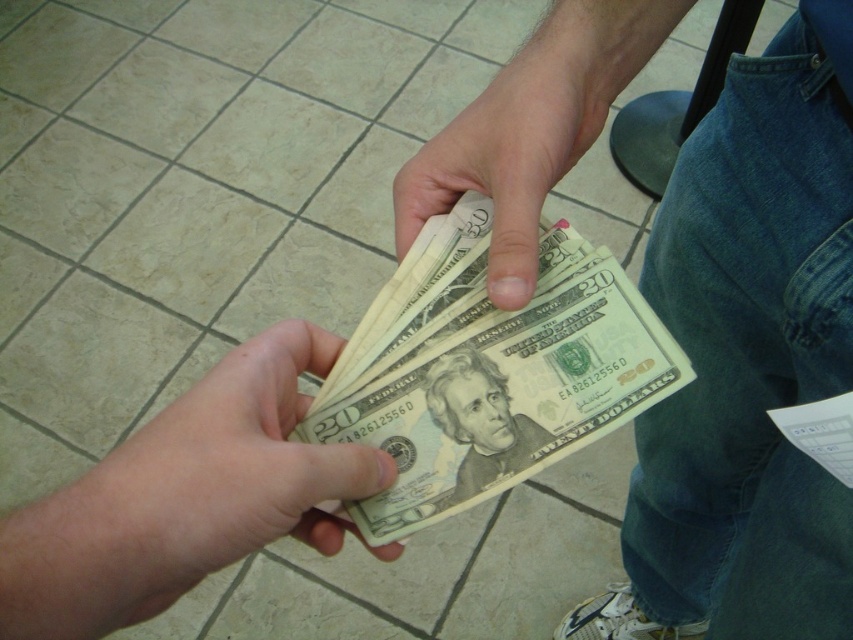
Question: Observing the image, what is the correct spatial positioning of smooth yellowish-green bill at center in reference to light brown paper money at center?

Choices:
 (A) below
 (B) above

Answer: (A)

Question: Which of the following is the farthest from the observer?

Choices:
 (A) 749,269
 (B) 605,259
 (C) 548,93
 (D) 74,636

Answer: (A)

Question: Which point appears closest to the camera in this image?

Choices:
 (A) (799, 154)
 (B) (467, 499)

Answer: (B)

Question: Estimate the real-world distances between objects in this image. Which object is closer to the smooth yellowish-green bill at center?

Choices:
 (A) smooth paper money at center
 (B) matte paper money at center
 (C) light brown paper money at center
 (D) smooth paper twenty-dollar bill at center

Answer: (C)

Question: Is smooth paper money at center further to camera compared to smooth yellowish-green bill at center?

Choices:
 (A) no
 (B) yes

Answer: (B)

Question: Is smooth yellowish-green bill at center smaller than light brown paper money at center?

Choices:
 (A) yes
 (B) no

Answer: (B)